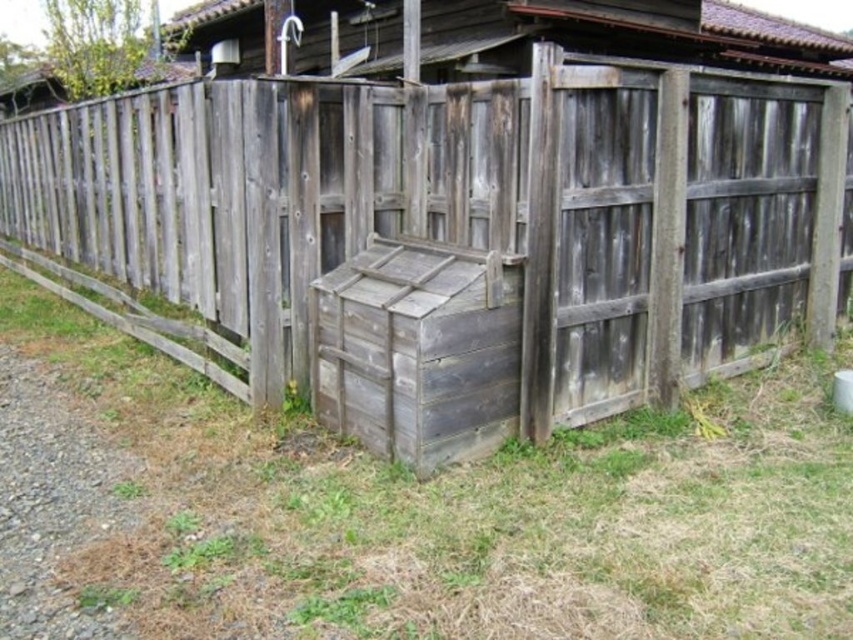
Question: Is the position of weathered wood fence at center more distant than that of green grass at lower center?

Choices:
 (A) no
 (B) yes

Answer: (B)

Question: Estimate the real-world distances between objects in this image. Which object is farther from the weathered wood fence at center?

Choices:
 (A) green grass at lower center
 (B) weathered wood crate at center

Answer: (A)

Question: Can you confirm if weathered wood fence at center is positioned below green grass at lower center?

Choices:
 (A) no
 (B) yes

Answer: (A)

Question: Which is farther from the green grass at lower center?

Choices:
 (A) weathered wood crate at center
 (B) weathered wood fence at center

Answer: (B)

Question: Can you confirm if weathered wood fence at center is positioned to the left of weathered wood crate at center?

Choices:
 (A) no
 (B) yes

Answer: (B)

Question: Which point is farther to the camera?

Choices:
 (A) (486, 234)
 (B) (387, 308)
 (C) (718, 582)

Answer: (A)